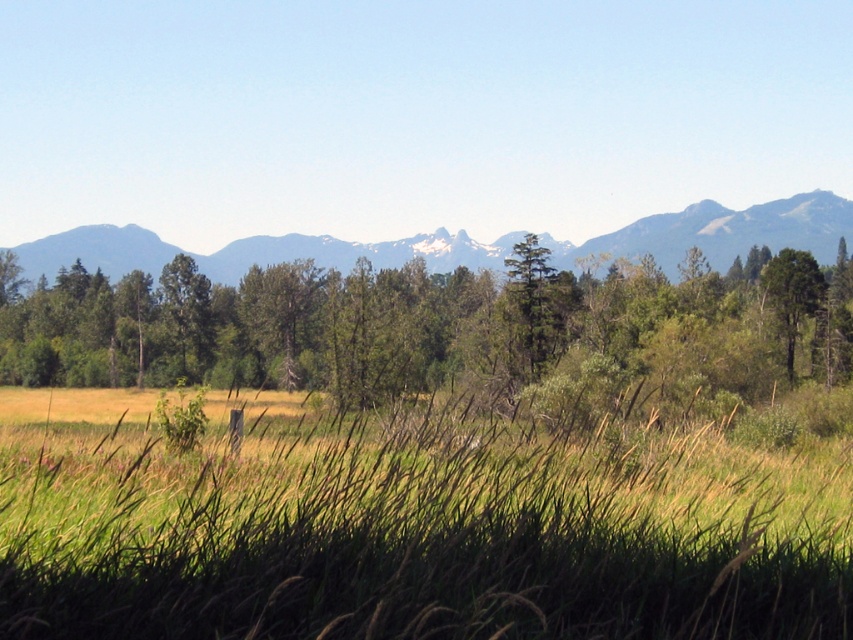
Does green grassy at center appear over snow-capped mountains at upper center?

Actually, green grassy at center is below snow-capped mountains at upper center.

Is green grassy at center wider than snow-capped mountains at upper center?

No.

Is point (793, 502) more distant than point (229, 268)?

No, it is not.

The height and width of the screenshot is (640, 853). I want to click on green grassy at center, so click(x=409, y=529).

Is green leafy tree at center shorter than snow-capped mountains at upper center?

Yes, green leafy tree at center is shorter than snow-capped mountains at upper center.

Is green leafy tree at center taller than snow-capped mountains at upper center?

No, green leafy tree at center is not taller than snow-capped mountains at upper center.

Where is `green leafy tree at center`? The width and height of the screenshot is (853, 640). green leafy tree at center is located at coordinates (433, 326).

The image size is (853, 640). Find the location of `green leafy tree at center`. green leafy tree at center is located at coordinates (433, 326).

Between snow-capped mountains at upper center and green textured tree at center, which one appears on the right side from the viewer's perspective?

From the viewer's perspective, green textured tree at center appears more on the right side.

Is snow-capped mountains at upper center positioned behind green textured tree at center?

Yes.

Locate an element on the screen. The height and width of the screenshot is (640, 853). snow-capped mountains at upper center is located at coordinates (721, 232).